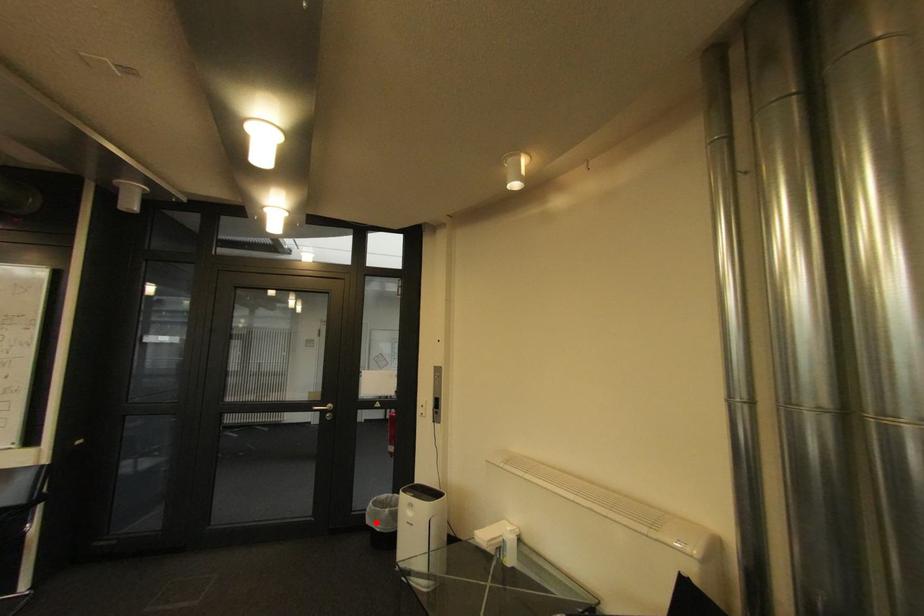
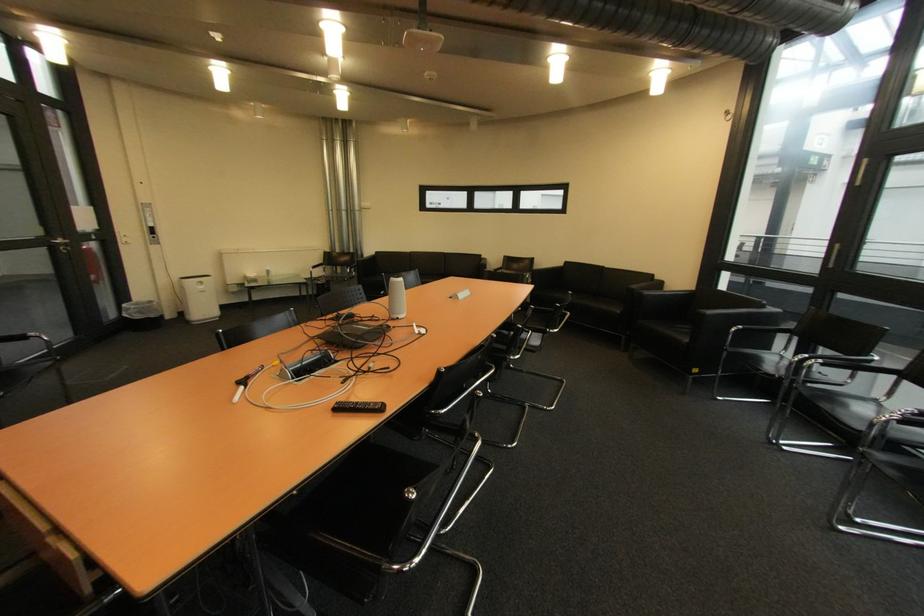
Question: I am providing you with two images of the same scene from different viewpoints. A red point is shown in image1. For the corresponding object point in image2, is it positioned nearer or farther from the camera?

Choices:
 (A) Nearer
 (B) Farther

Answer: (A)